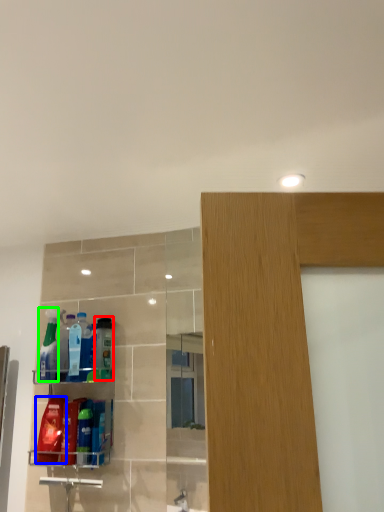
Question: Based on their relative distances, which object is farther from cleaning product (highlighted by a red box)? Choose from cleaning product (highlighted by a blue box) and cleaning product (highlighted by a green box).

Choices:
 (A) cleaning product
 (B) cleaning product

Answer: (A)